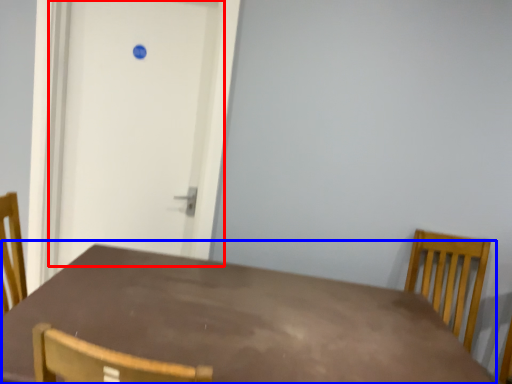
Question: Which object is further to the camera taking this photo, door (highlighted by a red box) or table (highlighted by a blue box)?

Choices:
 (A) door
 (B) table

Answer: (A)